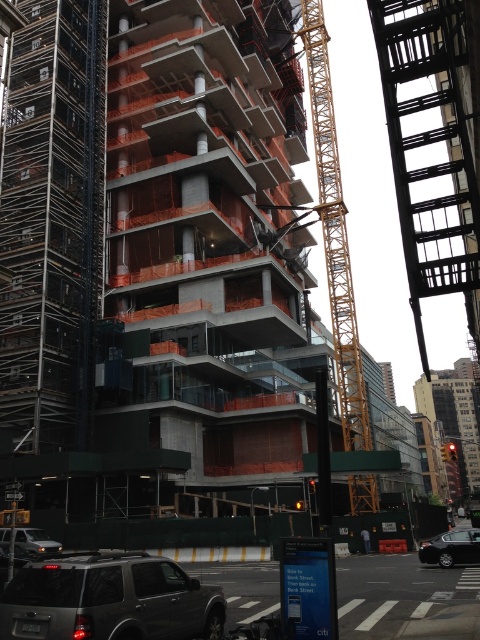
Between matte gray suv at lower left and yellow metallic crane at center, which one has less height?

With less height is matte gray suv at lower left.

Is matte gray suv at lower left below yellow metallic crane at center?

Indeed, matte gray suv at lower left is positioned under yellow metallic crane at center.

This screenshot has width=480, height=640. Find the location of `matte gray suv at lower left`. matte gray suv at lower left is located at coordinates (108, 600).

From the picture: Between matte gray suv at lower left and black fabric construction worker at center, which one appears on the right side from the viewer's perspective?

black fabric construction worker at center is more to the right.

What do you see at coordinates (108, 600) in the screenshot?
I see `matte gray suv at lower left` at bounding box center [108, 600].

Between point (183, 588) and point (365, 547), which one is positioned behind?

Positioned behind is point (365, 547).

This screenshot has width=480, height=640. I want to click on matte gray suv at lower left, so click(108, 600).

Looking at this image, does metal scaffolding at left appear on the right side of matte gray suv at lower left?

In fact, metal scaffolding at left is to the left of matte gray suv at lower left.

Image resolution: width=480 pixels, height=640 pixels. In order to click on metal scaffolding at left in this screenshot , I will do `click(51, 221)`.